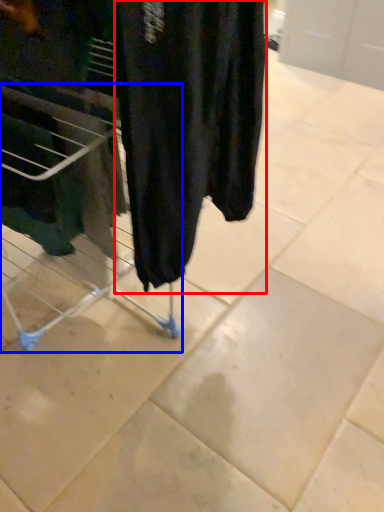
Question: Which point is further to the camera, clothing (highlighted by a red box) or furniture (highlighted by a blue box)?

Choices:
 (A) clothing
 (B) furniture

Answer: (B)